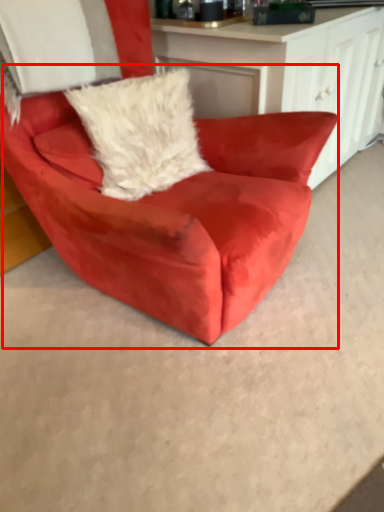
Question: In this image, where is chair (annotated by the red box) located relative to pillow?

Choices:
 (A) right
 (B) left

Answer: (A)